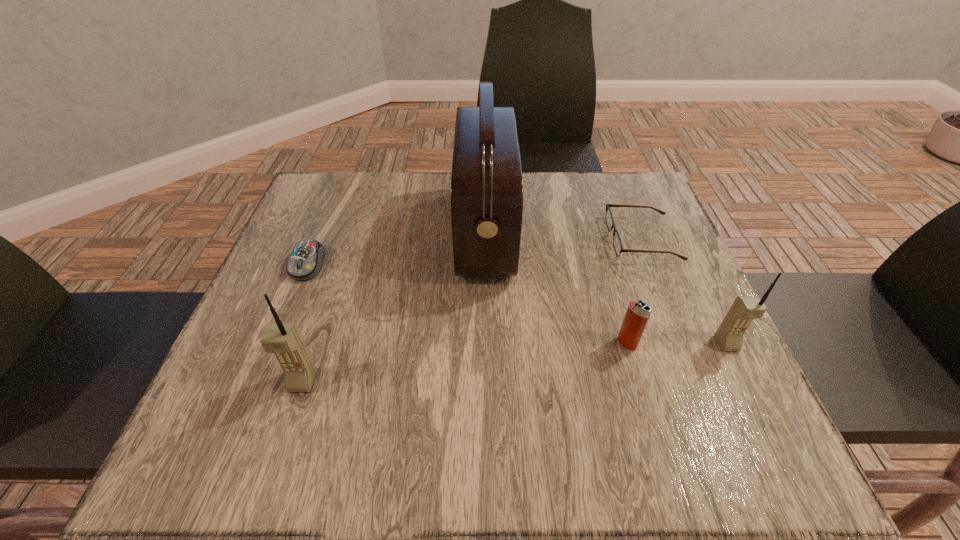
If equal spacing is the goal by inserting an additional cellular_telephone among them, please point out a vacant space for this new cellular_telephone. Please provide its 2D coordinates. Your answer should be formatted as a tuple, i.e. [(x, y)], where the tuple contains the x and y coordinates of a point satisfying the conditions above.

[(522, 362)]